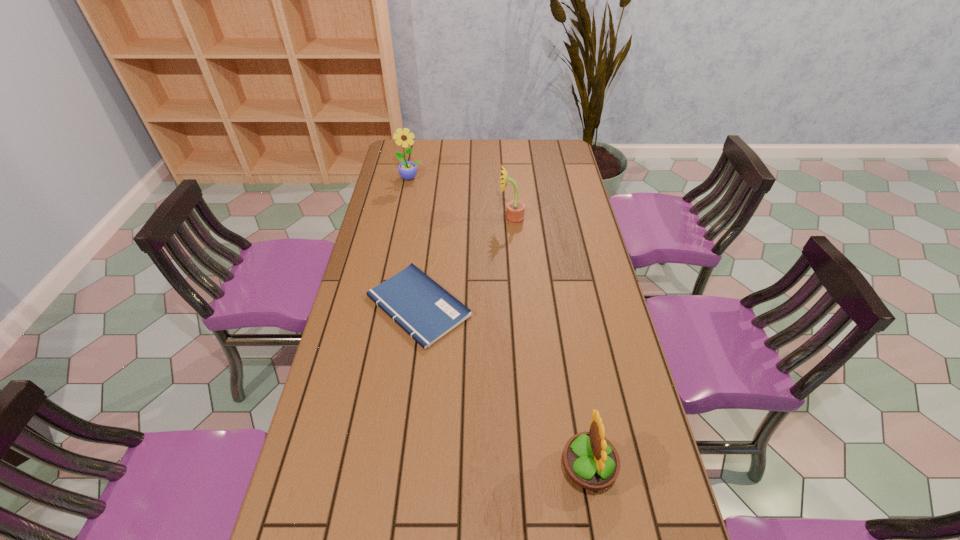
The image size is (960, 540). I want to click on free space at the left edge of the desktop, so click(388, 256).

Identify the location of vacant region at the right edge. (564, 257).

Where is `free space at the far left corner of the desktop`? Image resolution: width=960 pixels, height=540 pixels. free space at the far left corner of the desktop is located at coordinates (416, 148).

Find the location of a particular element. free point at the far right corner is located at coordinates (560, 153).

Where is `free space that is in between the shortest object and the second sunflower from right to left`? The width and height of the screenshot is (960, 540). free space that is in between the shortest object and the second sunflower from right to left is located at coordinates (465, 262).

Find the location of `vacant space that's between the second sunflower from right to left and the paperback book`. vacant space that's between the second sunflower from right to left and the paperback book is located at coordinates (465, 262).

Locate an element on the screen. blank region between the farthest object and the paperback book is located at coordinates (415, 242).

The height and width of the screenshot is (540, 960). What are the coordinates of `free space that is in between the paperback book and the leftmost sunflower` in the screenshot? It's located at (415, 242).

Locate an element on the screen. The height and width of the screenshot is (540, 960). empty space that is in between the second sunflower from left to right and the leftmost sunflower is located at coordinates (461, 199).

The image size is (960, 540). I want to click on vacant space that is in between the second nearest sunflower and the second nearest object, so click(x=465, y=262).